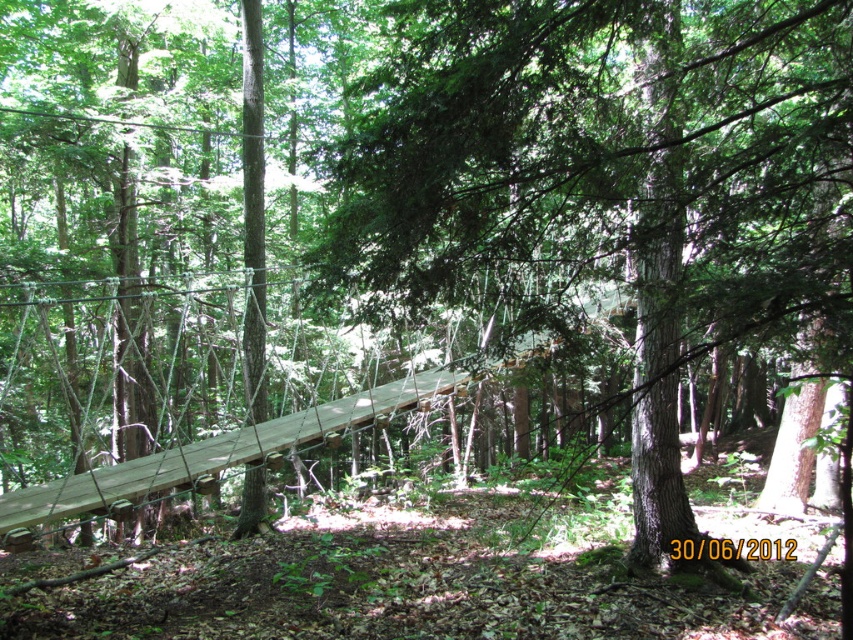
You are a hiker who wants to cross the forest safely. You see the brown wood bridge at center and the wooden plank bridge at center. Which bridge is lower to the ground?

The brown wood bridge at center has a lesser height compared to the wooden plank bridge at center, so the brown wood bridge at center is lower to the ground.

You are a hiker who wants to cross the forest. You see two bridges in the scene, the brown wood bridge at center and the wooden plank bridge at center. Which bridge takes up more space in the image?

The wooden plank bridge at center occupies more space than the brown wood bridge at center according to the description.